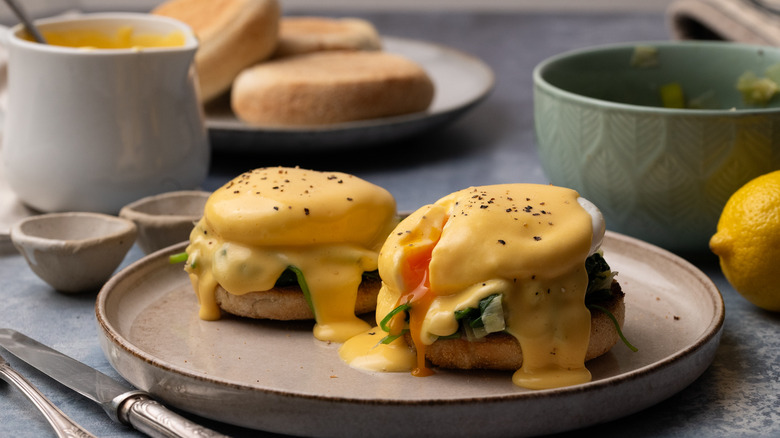
I want to click on eating utensils, so click(x=75, y=375), click(x=41, y=403).